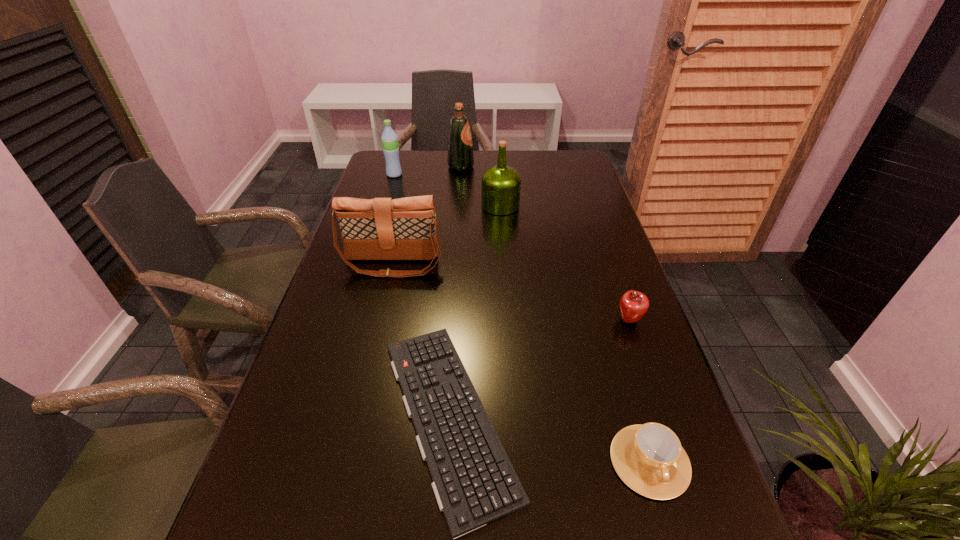
Where is `free space located 0.340m on the left of the nearer olive oil`? free space located 0.340m on the left of the nearer olive oil is located at coordinates (376, 205).

Find the location of `free spot located on the front of the water bottle`. free spot located on the front of the water bottle is located at coordinates (388, 196).

Find the location of a particular element. This screenshot has height=540, width=960. vacant space located 0.170m on the front-facing side of the shoulder bag is located at coordinates (377, 326).

Where is `vacant space positioned 0.270m on the front of the apple`? The image size is (960, 540). vacant space positioned 0.270m on the front of the apple is located at coordinates (671, 440).

Identify the location of blank area located on the left of the computer keyboard. (334, 415).

Where is `olive oil present at the far edge`? olive oil present at the far edge is located at coordinates (460, 158).

This screenshot has width=960, height=540. I want to click on water bottle situated at the far edge, so click(x=389, y=138).

I want to click on water bottle at the left edge, so click(389, 138).

What are the coordinates of `shoulder bag located in the left edge section of the desktop` in the screenshot? It's located at (405, 228).

I want to click on apple that is at the right edge, so click(x=633, y=305).